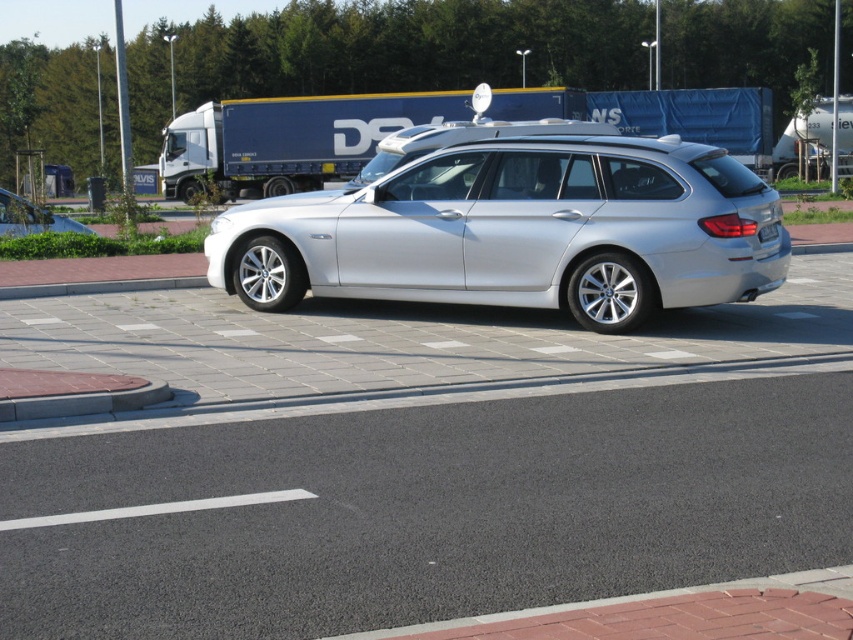
Is blue tarpaulin trailer truck at center shorter than matte silver car at left?

No.

Is blue tarpaulin trailer truck at center further to camera compared to matte silver car at left?

Yes, blue tarpaulin trailer truck at center is behind matte silver car at left.

Looking at this image, measure the distance between point [311,170] and camera.

They are 113.22 feet apart.

I want to click on blue tarpaulin trailer truck at center, so click(289, 140).

Between sleek silver wagon at center and blue tarpaulin trailer truck at center, which one has more height?

blue tarpaulin trailer truck at center is taller.

Is point (296, 204) less distant than point (659, 115)?

Yes, point (296, 204) is closer to viewer.

Is point (572, 204) closer to viewer compared to point (744, 138)?

Yes, it is in front of point (744, 138).

Find the location of `sleek silver wagon at center`. sleek silver wagon at center is located at coordinates pyautogui.click(x=518, y=228).

Is point (343, 250) positioned behind point (24, 227)?

That is False.

Does sleek silver wagon at center have a lesser height compared to matte silver car at left?

Indeed, sleek silver wagon at center has a lesser height compared to matte silver car at left.

Which is behind, point (683, 237) or point (39, 212)?

Positioned behind is point (39, 212).

What are the coordinates of `sleek silver wagon at center` in the screenshot? It's located at (518, 228).